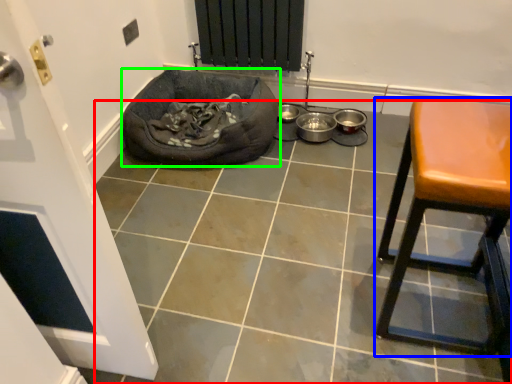
Question: Considering the real-world distances, which object is farthest from tile (highlighted by a red box)? furniture (highlighted by a blue box) or dog bed (highlighted by a green box)?

Choices:
 (A) furniture
 (B) dog bed

Answer: (B)